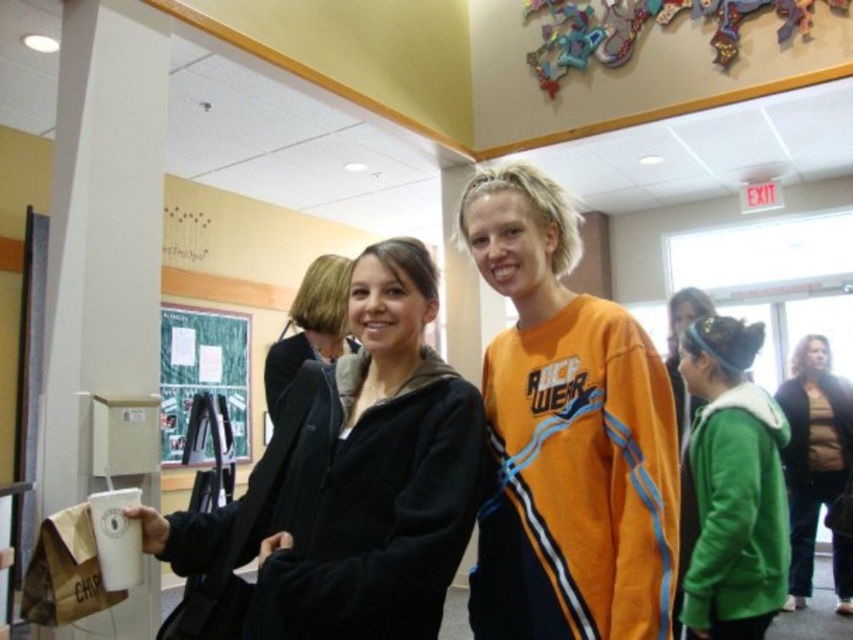
Question: Which of the following is the closest to the observer?

Choices:
 (A) (88, 634)
 (B) (740, 513)

Answer: (B)

Question: Which point appears closest to the camera in this image?

Choices:
 (A) (329, 360)
 (B) (776, 416)
 (C) (123, 156)
 (D) (296, 570)

Answer: (D)

Question: Where is green fuzzy coat at center located in relation to green matte bulletin board at center in the image?

Choices:
 (A) below
 (B) above

Answer: (A)

Question: Is matte black hoodie at center below white matte pillar at left?

Choices:
 (A) no
 (B) yes

Answer: (B)

Question: Where is green fuzzy jacket at right located in relation to matte black jacket at center in the image?

Choices:
 (A) above
 (B) below

Answer: (B)

Question: Among these objects, which one is nearest to the camera?

Choices:
 (A) white matte pillar at left
 (B) green matte bulletin board at center
 (C) green fuzzy jacket at right
 (D) matte black hoodie at center

Answer: (D)